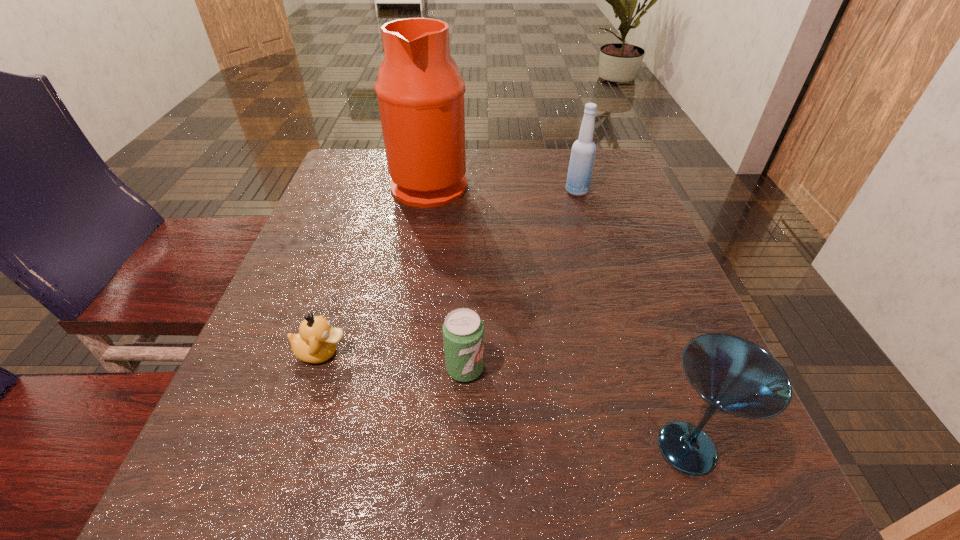
What are the coordinates of `vacant space that satisfies the following two spatial constraints: 1. on the front side of the martini; 2. on the left side of the bottle` in the screenshot? It's located at (653, 448).

You are a GUI agent. You are given a task and a screenshot of the screen. Output one action in this format:
    pyautogui.click(x=<x>, y=<y>)
    Task: Click on the vacant space that satisfies the following two spatial constraints: 1. from the spout of the tallest object; 2. on the right side of the second shortest object
    The height and width of the screenshot is (540, 960).
    Given the screenshot: What is the action you would take?
    pyautogui.click(x=400, y=369)

Image resolution: width=960 pixels, height=540 pixels. Find the location of `vacant space that satisfies the following two spatial constraints: 1. from the spout of the tallest object; 2. on the back side of the soda`. vacant space that satisfies the following two spatial constraints: 1. from the spout of the tallest object; 2. on the back side of the soda is located at coordinates (400, 369).

Where is `vacant space that satisfies the following two spatial constraints: 1. on the face of the shortest object; 2. on the back side of the third shortest object`? The image size is (960, 540). vacant space that satisfies the following two spatial constraints: 1. on the face of the shortest object; 2. on the back side of the third shortest object is located at coordinates (291, 448).

Locate an element on the screen. free space that satisfies the following two spatial constraints: 1. on the face of the duckling; 2. on the left side of the martini is located at coordinates (291, 448).

Where is `free location that satisfies the following two spatial constraints: 1. on the face of the duckling; 2. on the back side of the soda`? free location that satisfies the following two spatial constraints: 1. on the face of the duckling; 2. on the back side of the soda is located at coordinates (317, 369).

I want to click on vacant space that satisfies the following two spatial constraints: 1. on the back side of the fourth tallest object; 2. on the left side of the bottle, so click(470, 191).